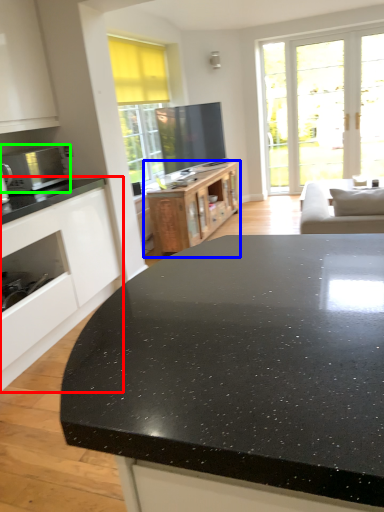
Question: Which object is the closest to the cabinetry (highlighted by a red box)? Choose among these: cabinetry (highlighted by a blue box) or microwave oven (highlighted by a green box).

Choices:
 (A) cabinetry
 (B) microwave oven

Answer: (B)